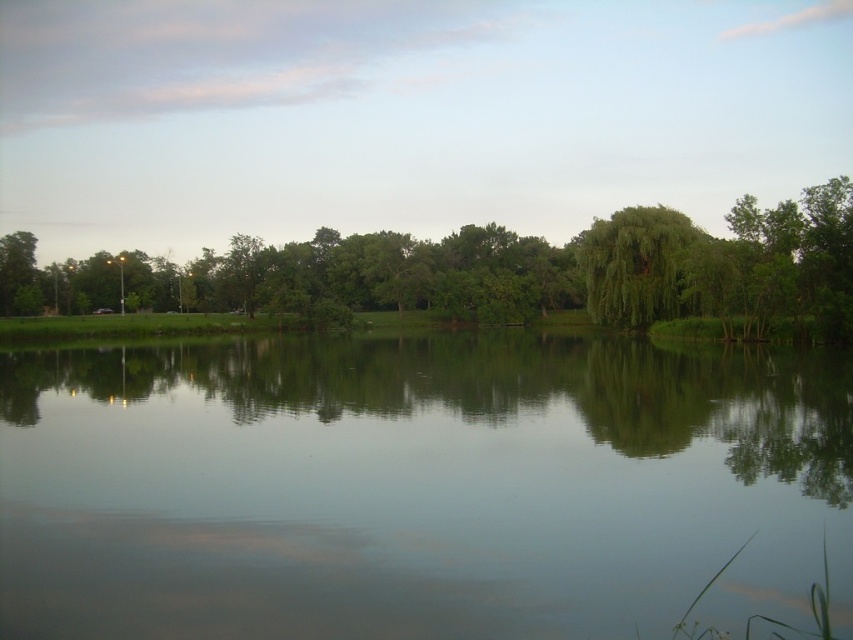
Consider the image. You are standing at the center of the image and want to locate the green leafy tree at center. What are its coordinates?

The green leafy tree at center is located at coordinates point (495, 273).

You are standing at the lakeside and see two points marked in the image. Which point is closer to you, point (x=495, y=362) or point (x=666, y=243)?

Point (x=495, y=362) is in front of point (x=666, y=243), so it is closer to you.

You are an artist planning to paint the lakeside scene. You want to ensure the green leafy tree at center and the green leafy tree at upper right are proportionally accurate. Which tree should you draw wider in your painting?

The green leafy tree at center should be drawn wider than the green leafy tree at upper right because its width is larger according to the description.